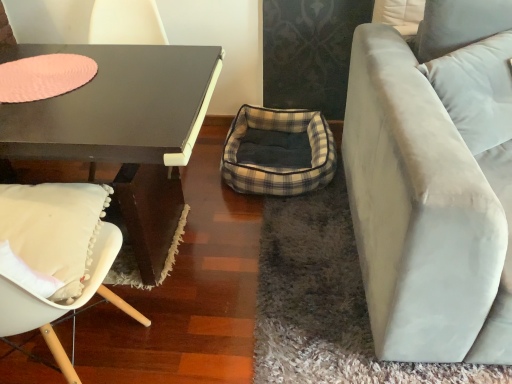
This screenshot has width=512, height=384. What do you see at coordinates (116, 106) in the screenshot?
I see `matte black coffee table at left` at bounding box center [116, 106].

The height and width of the screenshot is (384, 512). Identify the location of white fabric chair at left. (56, 255).

Identify the location of white fabric pillow at upper right. This screenshot has height=384, width=512. (476, 90).

Describe the element at coordinates (44, 76) in the screenshot. I see `pink felt placemat at upper left` at that location.

Describe the element at coordinates (278, 151) in the screenshot. I see `plaid fabric bean bag at center` at that location.

Identify the location of light beige fabric couch at right. (434, 182).

Is white fabric pillow at upper right completely or partially outside of light beige fabric couch at right?

Actually, white fabric pillow at upper right is within light beige fabric couch at right.

Is white fabric pillow at upper right next to light beige fabric couch at right and touching it?

white fabric pillow at upper right and light beige fabric couch at right are not in contact.

The height and width of the screenshot is (384, 512). In order to click on studio couch on the right of white fabric pillow at upper right in this screenshot , I will do `click(434, 182)`.

At what (x,y) coordinates should I click in order to perform the action: click on glass table located behind the light beige fabric couch at right. Please return your answer as a coordinate pair (x, y). Looking at the image, I should click on (116, 106).

In the scene shown: Is light beige fabric couch at right oriented towards matte black table at left?

No, light beige fabric couch at right is not aimed at matte black table at left.

Considering the positions of objects light beige fabric couch at right and matte black table at left in the image provided, who is more to the left, light beige fabric couch at right or matte black table at left?

matte black table at left.

Can you confirm if light beige fabric couch at right is thinner than matte black table at left?

No, light beige fabric couch at right is not thinner than matte black table at left.

Relative to plaid fabric bean bag at center, is white fabric pillow at upper right in front or behind?

In the image, white fabric pillow at upper right appears in front of plaid fabric bean bag at center.

From a real-world perspective, is white fabric pillow at upper right below plaid fabric bean bag at center?

No, from a real-world perspective, white fabric pillow at upper right is not under plaid fabric bean bag at center.

Could you tell me if white fabric pillow at upper right is facing plaid fabric bean bag at center?

No, white fabric pillow at upper right is not facing towards plaid fabric bean bag at center.

Is point (423, 214) in front of point (285, 133)?

Yes, point (423, 214) is closer to viewer.

In order to click on bean bag chair located behind the light beige fabric couch at right in this screenshot , I will do `click(278, 151)`.

Is light beige fabric couch at right to the left of plaid fabric bean bag at center from the viewer's perspective?

No.

Could you tell me if light beige fabric couch at right is turned towards plaid fabric bean bag at center?

No, light beige fabric couch at right is not oriented towards plaid fabric bean bag at center.

Is plaid fabric bean bag at center oriented away from light beige fabric couch at right?

No, plaid fabric bean bag at center is not facing away from light beige fabric couch at right.

From a real-world perspective, which object rests below the other?

plaid fabric bean bag at center is physically lower.

From the image's perspective, which is above, plaid fabric bean bag at center or light beige fabric couch at right?

plaid fabric bean bag at center is shown above in the image.

Locate an element on the screen. The height and width of the screenshot is (384, 512). studio couch on the right side of plaid fabric bean bag at center is located at coordinates (434, 182).

Considering the relative sizes of matte black table at left and light beige fabric couch at right in the image provided, is matte black table at left bigger than light beige fabric couch at right?

No, matte black table at left is not bigger than light beige fabric couch at right.

How far apart are matte black table at left and light beige fabric couch at right?

matte black table at left is 29.79 inches away from light beige fabric couch at right.

Based on the photo, from a real-world perspective, relative to light beige fabric couch at right, is matte black table at left vertically above or below?

In terms of real-world spatial position, matte black table at left is above light beige fabric couch at right.

From the image's perspective, which object appears higher, matte black table at left or light beige fabric couch at right?

matte black table at left.

Can you see light beige fabric couch at right touching white fabric chair at left?

light beige fabric couch at right and white fabric chair at left are clearly separated.

Does light beige fabric couch at right have a lesser width compared to white fabric chair at left?

In fact, light beige fabric couch at right might be wider than white fabric chair at left.

From the image's perspective, between light beige fabric couch at right and white fabric chair at left, which one is located above?

light beige fabric couch at right, from the image's perspective.

Find the location of a particular element. studio couch on the right of white fabric pillow at upper right is located at coordinates (x=434, y=182).

Find the location of `glass table on the left side of light beige fabric couch at right`. glass table on the left side of light beige fabric couch at right is located at coordinates (116, 106).

Which object lies nearer to the anchor point white fabric chair at left, pink felt placemat at upper left or light beige fabric couch at right?

Based on the image, pink felt placemat at upper left appears to be nearer to white fabric chair at left.

Based on the photo, based on their spatial positions, is white fabric pillow at upper right or pink felt placemat at upper left further from matte black coffee table at left?

Based on the image, white fabric pillow at upper right appears to be further to matte black coffee table at left.

Which object lies further to the anchor point white fabric pillow at upper right, light beige fabric couch at right or plaid fabric bean bag at center?

Based on the image, plaid fabric bean bag at center appears to be further to white fabric pillow at upper right.

Estimate the real-world distances between objects in this image. Which object is closer to white fabric pillow at upper right, pink felt placemat at upper left or white fabric chair at left?

Among the two, white fabric chair at left is located nearer to white fabric pillow at upper right.

When comparing their distances from white fabric pillow at upper right, does matte black coffee table at left or matte black table at left seem closer?

The object closer to white fabric pillow at upper right is matte black table at left.

Which object lies further to the anchor point light beige fabric couch at right, pink felt placemat at upper left or matte black coffee table at left?

Among the two, pink felt placemat at upper left is located further to light beige fabric couch at right.

Estimate the real-world distances between objects in this image. Which object is closer to light beige fabric couch at right, matte black coffee table at left or matte black table at left?

Among the two, matte black table at left is located nearer to light beige fabric couch at right.

Looking at the image, which one is located closer to matte black table at left, matte black coffee table at left or white fabric pillow at upper right?

Among the two, matte black coffee table at left is located nearer to matte black table at left.

The image size is (512, 384). In order to click on coffee table between pink felt placemat at upper left and light beige fabric couch at right in this screenshot , I will do `click(116, 106)`.

Where is `coffee table between pink felt placemat at upper left and white fabric chair at left in the up-down direction`? Image resolution: width=512 pixels, height=384 pixels. coffee table between pink felt placemat at upper left and white fabric chair at left in the up-down direction is located at coordinates (116, 106).

Locate an element on the screen. The width and height of the screenshot is (512, 384). coffee table between white fabric chair at left and plaid fabric bean bag at center along the z-axis is located at coordinates (116, 106).

You are a GUI agent. You are given a task and a screenshot of the screen. Output one action in this format:
    pyautogui.click(x=<x>, y=<y>)
    Task: Click on the pillow between pink felt placemat at upper left and light beige fabric couch at right
    Image resolution: width=512 pixels, height=384 pixels.
    Given the screenshot: What is the action you would take?
    pyautogui.click(x=476, y=90)